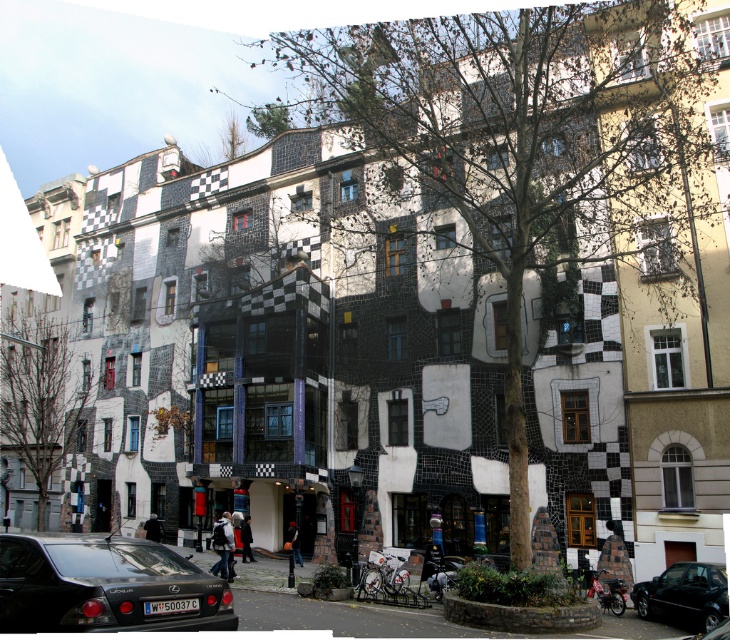
You are a fashion designer observing the image. You see a dark gray fabric coat at center and a dark blue fabric jacket at center. Which clothing item is placed on top of the other?

The dark gray fabric coat at center is positioned over the dark blue fabric jacket at center, so the dark gray fabric coat at center is on top.

Looking at this image, you are standing in front of the architectural structure and notice a point marked at coordinates (104, 586). What object is located at this point?

The point at (104, 586) indicates a black glossy car at lower left.

You are a fashion designer observing the image of a modern architectural structure with vibrant mosaic tiling. You notice a white cotton jacket at lower center and a dark gray fabric coat at center. Which clothing item is placed higher up on the structure?

The white cotton jacket at lower center is positioned over the dark gray fabric coat at center, meaning it is placed higher up on the structure.